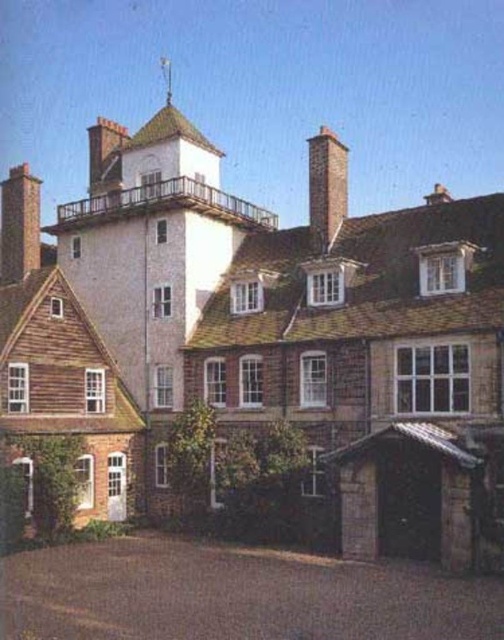
Which is more to the left, brick chimney at left or red brick chimney at upper right?

brick chimney at left is more to the left.

Does brick chimney at left have a larger size compared to red brick chimney at upper right?

Yes, brick chimney at left is bigger than red brick chimney at upper right.

Who is more forward, [28,177] or [328,179]?

Point [328,179]

Where is `brick chimney at left`? This screenshot has height=640, width=504. brick chimney at left is located at coordinates (19, 225).

Can you confirm if brick chimney at left is bigger than smooth brick chimney at upper center?

Indeed, brick chimney at left has a larger size compared to smooth brick chimney at upper center.

Is point (20, 275) positioned before point (118, 173)?

Yes, it is in front of point (118, 173).

Between point (37, 182) and point (118, 128), which one is positioned behind?

The point (118, 128) is more distant.

This screenshot has width=504, height=640. In order to click on brick chimney at left in this screenshot , I will do tap(19, 225).

Is red brick chimney at upper right thinner than smooth brick chimney at upper center?

Yes, red brick chimney at upper right is thinner than smooth brick chimney at upper center.

Which is in front, point (332, 198) or point (121, 125)?

Point (332, 198)

Between point (311, 211) and point (114, 180), which one is positioned in front?

Point (311, 211) is more forward.

This screenshot has width=504, height=640. In order to click on red brick chimney at upper right in this screenshot , I will do `click(327, 188)`.